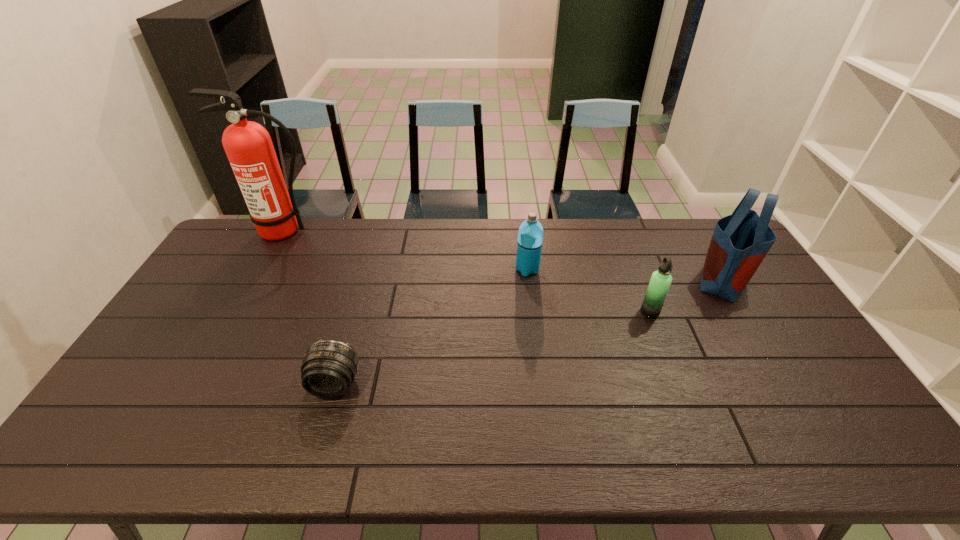
You are a GUI agent. You are given a task and a screenshot of the screen. Output one action in this format:
    pyautogui.click(x=<x>, y=<y>)
    Task: Click on the empty location between the fire extinguisher and the third object from right to left
    Image resolution: width=960 pixels, height=540 pixels.
    Given the screenshot: What is the action you would take?
    pyautogui.click(x=406, y=251)

Identify the location of free point between the fire extinguisher and the handbag. This screenshot has height=540, width=960. click(x=504, y=255).

Locate an element on the screen. The image size is (960, 540). free space between the farther thermos bottle and the handbag is located at coordinates (625, 274).

Find the location of a particular element. Image resolution: width=960 pixels, height=540 pixels. vacant region between the leftmost object and the nearest object is located at coordinates (310, 308).

Where is `vacant area that lies between the farthest object and the second nearest object`? vacant area that lies between the farthest object and the second nearest object is located at coordinates pyautogui.click(x=468, y=272).

Find the location of a particular element. The width and height of the screenshot is (960, 540). object that is the second closest to the third object from left to right is located at coordinates (740, 242).

At what (x,y) coordinates should I click in order to perform the action: click on object that ranks as the closest to the rightmost object. Please return your answer as a coordinate pair (x, y). Image resolution: width=960 pixels, height=540 pixels. Looking at the image, I should click on (660, 282).

At what (x,y) coordinates should I click in order to perform the action: click on free location that satisfies the following two spatial constraints: 1. on the handle side of the fire extinguisher; 2. on the left side of the right thermos bottle. Please return your answer as a coordinate pair (x, y). Looking at the image, I should click on (240, 312).

The image size is (960, 540). I want to click on vacant space that satisfies the following two spatial constraints: 1. on the handle side of the leftmost object; 2. on the left side of the farther thermos bottle, so click(263, 269).

Locate an element on the screen. The image size is (960, 540). vacant region that satisfies the following two spatial constraints: 1. on the handle side of the farthest object; 2. on the right side of the farther thermos bottle is located at coordinates (263, 269).